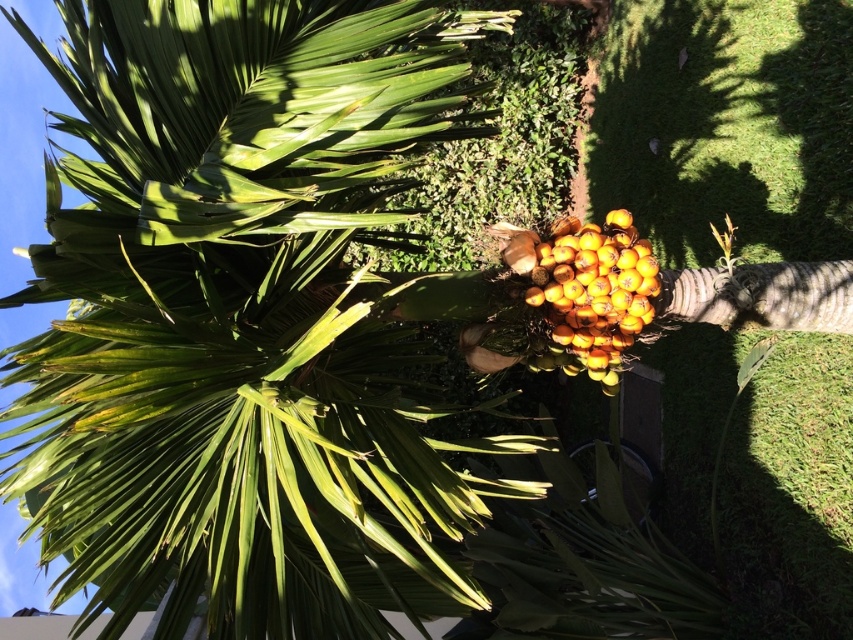
Looking at this image, you are a gardener holding a 1.5 meter long ladder. You need to prune the green leafy coconut tree at center. Can you reach the top of the tree with your ladder if you place it directly in front of the tree?

The distance between the green leafy coconut tree at center and the camera is 1.20 meters. Since the ladder is 1.5 meters long, it can reach beyond the distance to the tree, so you can prune the top of the green leafy coconut tree at center with the ladder placed directly in front of it.

You are a gardener who needs to water both the green leafy coconut tree at center and the yellow matte fruit at center. Since you can only reach objects within your arm length, which one should you water first based on their positions?

The green leafy coconut tree at center is in front of the yellow matte fruit at center, so you should water the green leafy coconut tree at center first as it is closer to you.

You are a gardener who wants to plant a new tree in your backyard. You have a green leafy coconut tree at center and a yellow matte fruit at center in the image. Which one is bigger in size?

The green leafy coconut tree at center has a larger size compared to the yellow matte fruit at center, so the green leafy coconut tree at center is bigger in size.